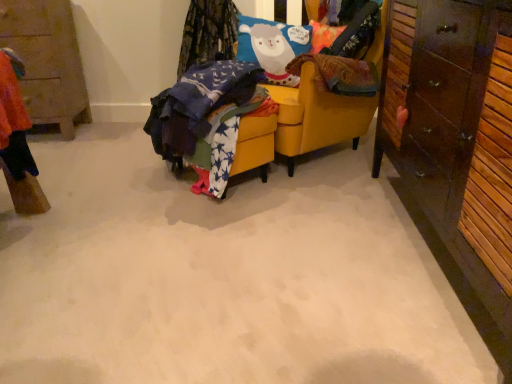
Question: Is wooden cabinet at left, which ranks as the 2th cabinetry in front-to-back order, wider than star-patterned fabric at center?

Choices:
 (A) no
 (B) yes

Answer: (B)

Question: Considering the relative sizes of wooden cabinet at left, which ranks as the 2th cabinetry in front-to-back order, and star-patterned fabric at center in the image provided, is wooden cabinet at left, which ranks as the 2th cabinetry in front-to-back order, taller than star-patterned fabric at center?

Choices:
 (A) yes
 (B) no

Answer: (A)

Question: Considering the relative sizes of wooden cabinet at left, which ranks as the 2th cabinetry in front-to-back order, and star-patterned fabric at center in the image provided, is wooden cabinet at left, which ranks as the 2th cabinetry in front-to-back order, shorter than star-patterned fabric at center?

Choices:
 (A) yes
 (B) no

Answer: (B)

Question: Does wooden cabinet at left, which ranks as the 2th cabinetry in front-to-back order, have a smaller size compared to star-patterned fabric at center?

Choices:
 (A) yes
 (B) no

Answer: (B)

Question: Could you tell me if wooden cabinet at left, which appears as the first cabinetry when viewed from the back, is facing star-patterned fabric at center?

Choices:
 (A) no
 (B) yes

Answer: (A)

Question: Is yellow fabric chair at center to the left or to the right of wooden cabinet at left, which appears as the first cabinetry when viewed from the back, in the image?

Choices:
 (A) left
 (B) right

Answer: (B)

Question: Is yellow fabric chair at center spatially inside wooden cabinet at left, which ranks as the 2th cabinetry in front-to-back order, or outside of it?

Choices:
 (A) outside
 (B) inside

Answer: (A)

Question: In terms of size, does yellow fabric chair at center appear bigger or smaller than wooden cabinet at left, which ranks as the 2th cabinetry in front-to-back order?

Choices:
 (A) small
 (B) big

Answer: (B)

Question: Is yellow fabric chair at center wider or thinner than wooden cabinet at left, which ranks as the 2th cabinetry in front-to-back order?

Choices:
 (A) wide
 (B) thin

Answer: (A)

Question: From the image's perspective, is star-patterned fabric at center above or below yellow fabric chair at center?

Choices:
 (A) below
 (B) above

Answer: (A)

Question: Considering the positions of star-patterned fabric at center and yellow fabric chair at center in the image, is star-patterned fabric at center taller or shorter than yellow fabric chair at center?

Choices:
 (A) short
 (B) tall

Answer: (A)

Question: Looking at their shapes, would you say star-patterned fabric at center is wider or thinner than yellow fabric chair at center?

Choices:
 (A) wide
 (B) thin

Answer: (B)

Question: Is point (188, 89) positioned closer to the camera than point (318, 96)?

Choices:
 (A) farther
 (B) closer

Answer: (B)

Question: Is dark brown wood cabinet at right, acting as the second cabinetry starting from the back, bigger or smaller than wooden cabinet at left, which appears as the second cabinetry when viewed from the right?

Choices:
 (A) big
 (B) small

Answer: (A)

Question: Is point (408, 190) positioned closer to the camera than point (31, 61)?

Choices:
 (A) farther
 (B) closer

Answer: (B)